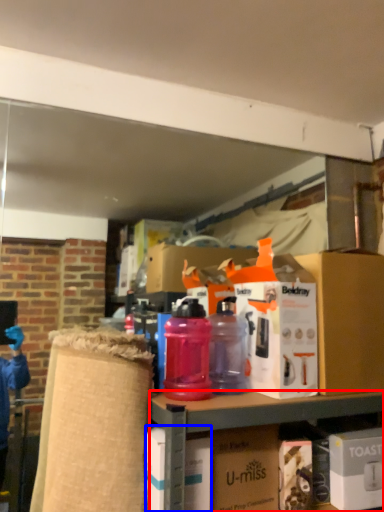
Question: Which object appears closest to the camera in this image, cabinetry (highlighted by a red box) or box (highlighted by a blue box)?

Choices:
 (A) cabinetry
 (B) box

Answer: (A)